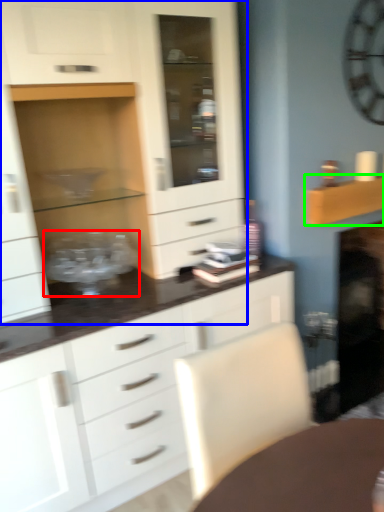
Question: Which object is the farthest from appliance (highlighted by a red box)? Choose among these: cabinetry (highlighted by a blue box) or shelf (highlighted by a green box).

Choices:
 (A) cabinetry
 (B) shelf

Answer: (B)